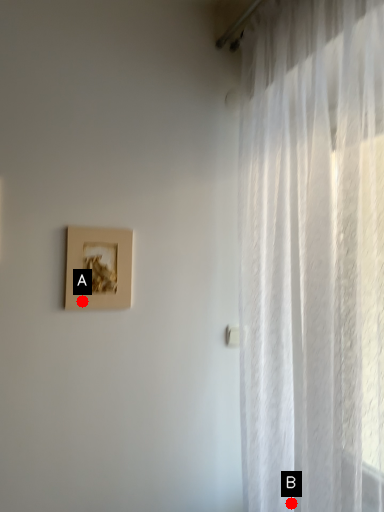
Question: Two points are circled on the image, labeled by A and B beside each circle. Which point is closer to the camera?

Choices:
 (A) A is closer
 (B) B is closer

Answer: (B)